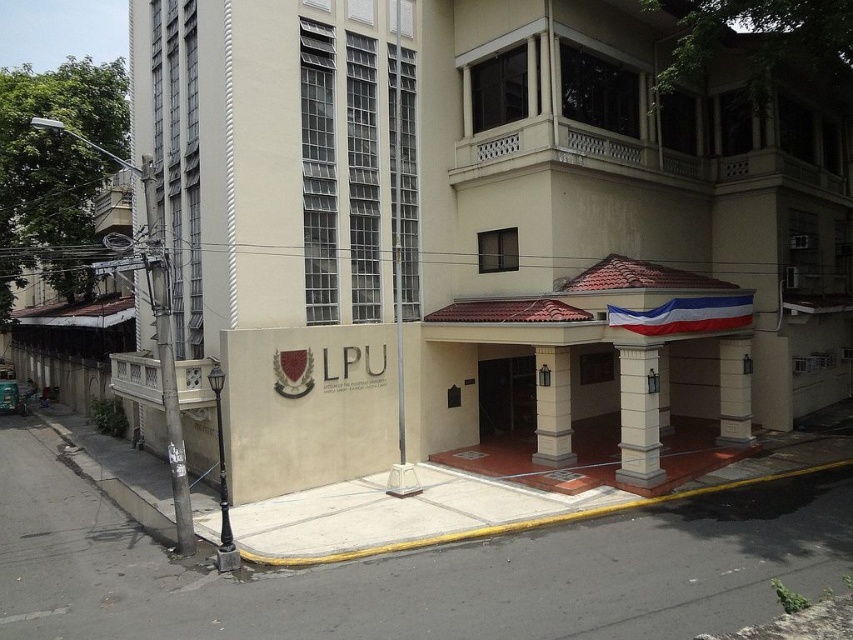
Does beige concrete building at center have a larger size compared to white fabric flag at center?

Correct, beige concrete building at center is larger in size than white fabric flag at center.

Which is in front, point (529, 349) or point (712, 296)?

Point (712, 296) is more forward.

This screenshot has height=640, width=853. In order to click on beige concrete building at center in this screenshot , I will do `click(606, 234)`.